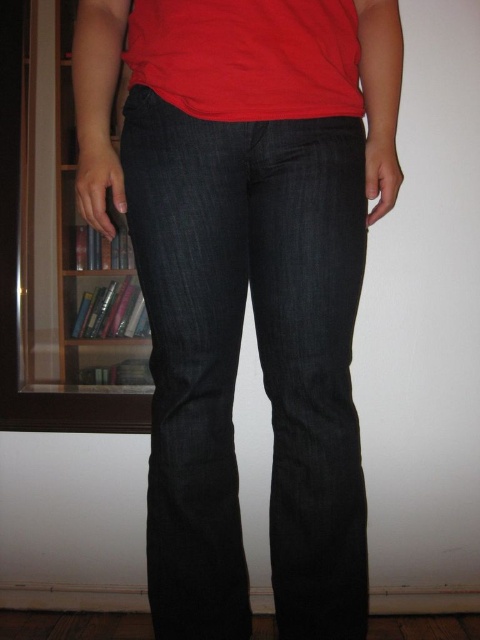
You are a fashion designer analyzing the positioning of clothing items in the image. The person is wearing a red t shirt and dark denim jeans. The dark denim jeans at center is represented by point (260, 360). Where is the dark denim jeans at center located in relation to the red t shirt?

The dark denim jeans at center is located at point 0.542, 0.564 in relation to the red t shirt.